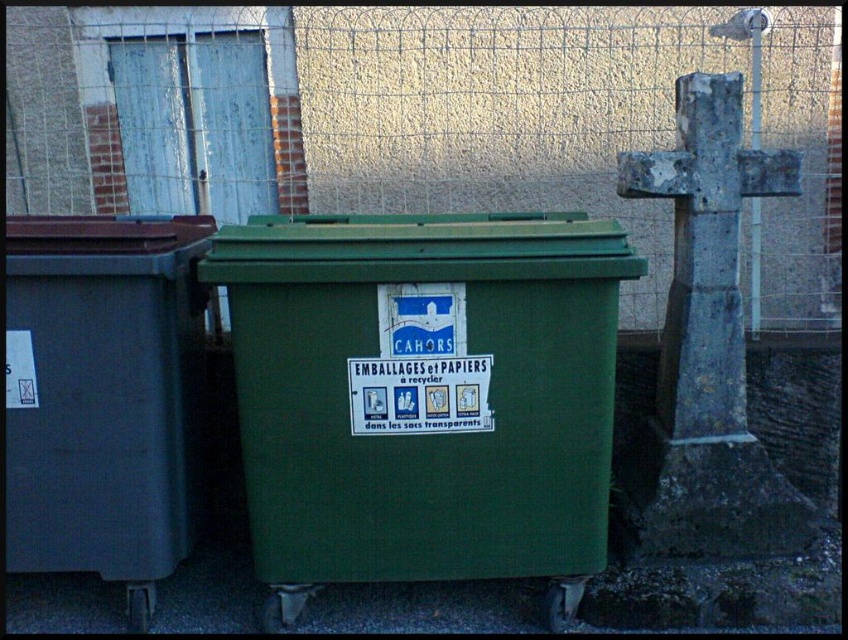
Can you confirm if green plastic recycling bin at center is wider than matte gray recycling bin at left?

Correct, the width of green plastic recycling bin at center exceeds that of matte gray recycling bin at left.

Between green plastic recycling bin at center and matte gray recycling bin at left, which one is positioned higher?

matte gray recycling bin at left

Is point (400, 388) positioned behind point (198, 326)?

No, (400, 388) is in front of (198, 326).

I want to click on green plastic recycling bin at center, so click(x=424, y=396).